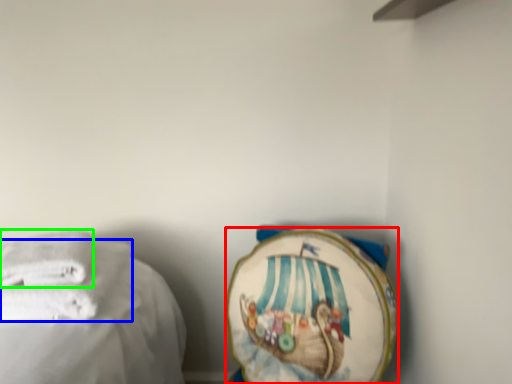
Question: Which object is positioned farthest from towel (highlighted by a red box)? Select from towel (highlighted by a blue box) and towel (highlighted by a green box).

Choices:
 (A) towel
 (B) towel

Answer: (B)